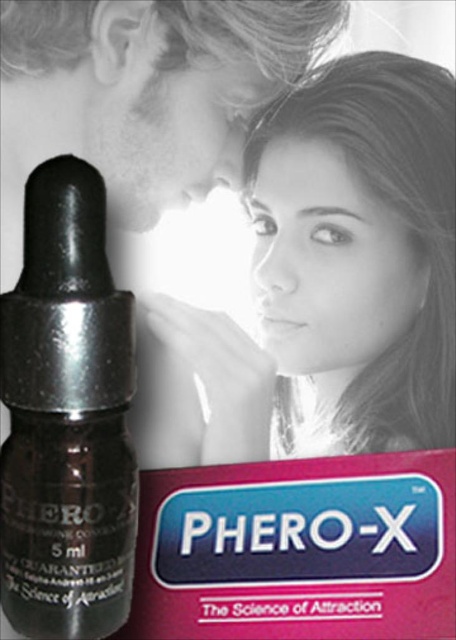
Based on the photo, which is more to the right, smooth skin face at upper center or matte black lipstick at center?

Positioned to the right is smooth skin face at upper center.

Is smooth skin face at upper center smaller than matte black lipstick at center?

No, smooth skin face at upper center is not smaller than matte black lipstick at center.

At what (x,y) coordinates should I click in order to perform the action: click on smooth skin face at upper center. Please return your answer as a coordinate pair (x, y). Looking at the image, I should click on (342, 266).

What are the coordinates of `smooth skin face at upper center` in the screenshot? It's located at (342, 266).

Between shiny black glass dropper at center-left and matte black lipstick at center, which one appears on the right side from the viewer's perspective?

matte black lipstick at center

Does shiny black glass dropper at center-left have a greater width compared to matte black lipstick at center?

Yes, shiny black glass dropper at center-left is wider than matte black lipstick at center.

Is point (19, 621) less distant than point (279, 333)?

Yes, point (19, 621) is closer to viewer.

Identify the location of shiny black glass dropper at center-left. The width and height of the screenshot is (456, 640). (67, 417).

Who is positioned more to the left, smooth skin face at upper center or shiny black glass dropper at center-left?

shiny black glass dropper at center-left

Does point (316, 333) lie in front of point (68, 240)?

No, it is behind (68, 240).

This screenshot has width=456, height=640. Describe the element at coordinates (342, 266) in the screenshot. I see `smooth skin face at upper center` at that location.

Identify the location of smooth skin face at upper center. The width and height of the screenshot is (456, 640). (342, 266).